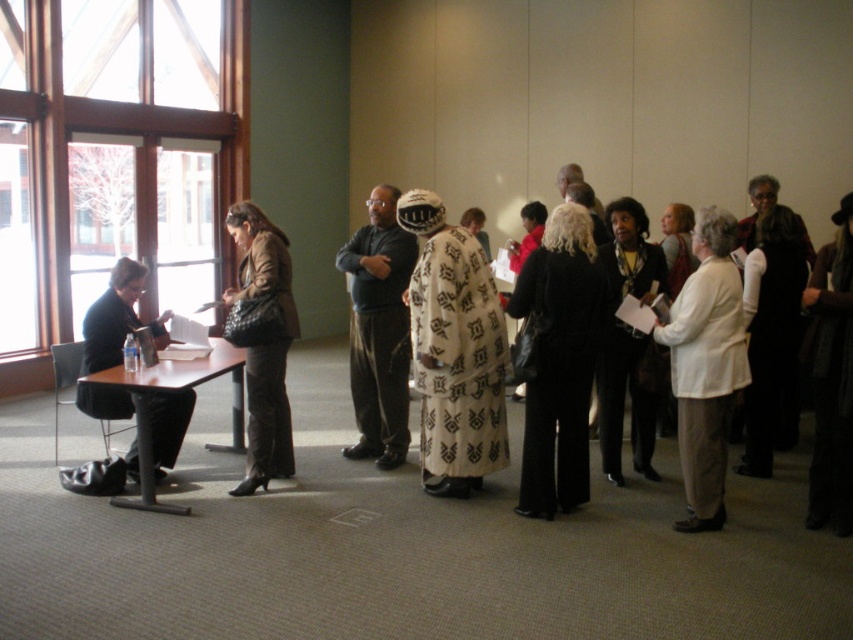
Question: Which point is farther to the camera?

Choices:
 (A) (151, 369)
 (B) (132, 406)
 (C) (378, 268)

Answer: (C)

Question: From the image, what is the correct spatial relationship of clear glass window at left in relation to matte black jacket at left?

Choices:
 (A) above
 (B) below

Answer: (A)

Question: Is white textured coat at center further to the viewer compared to white matte jacket at center-right?

Choices:
 (A) no
 (B) yes

Answer: (B)

Question: Estimate the real-world distances between objects in this image. Which object is closer to the brown wood table at left?

Choices:
 (A) dark gray sweater at center
 (B) matte black jacket at left
 (C) white matte jacket at center-right
 (D) clear glass window at left

Answer: (B)

Question: Does white textured coat at center lie in front of matte brown coat at center?

Choices:
 (A) no
 (B) yes

Answer: (B)

Question: Which point is farther to the camera?

Choices:
 (A) coord(136,326)
 (B) coord(181,260)
 (C) coord(265,260)

Answer: (B)